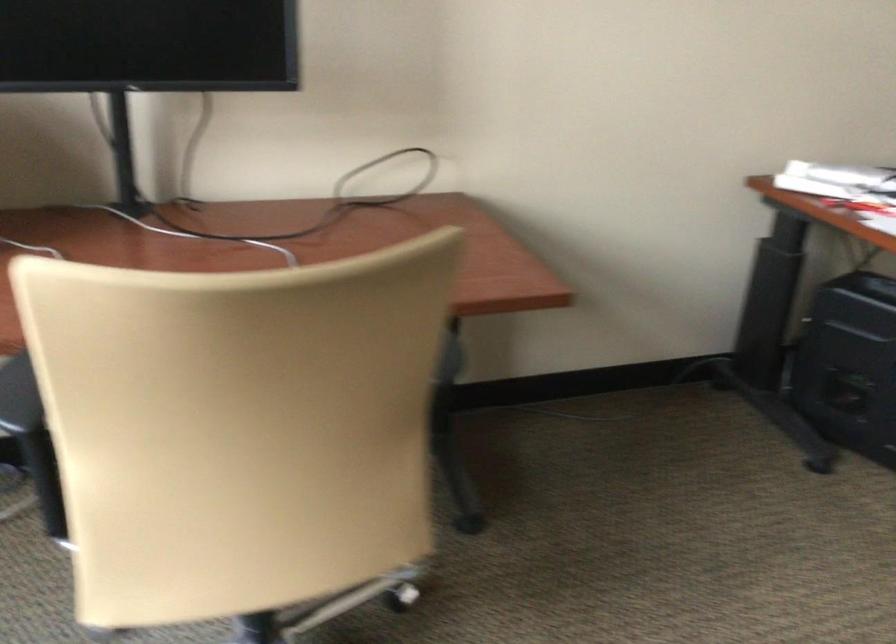
Find the location of a particular element. black computer tower is located at coordinates (849, 365).